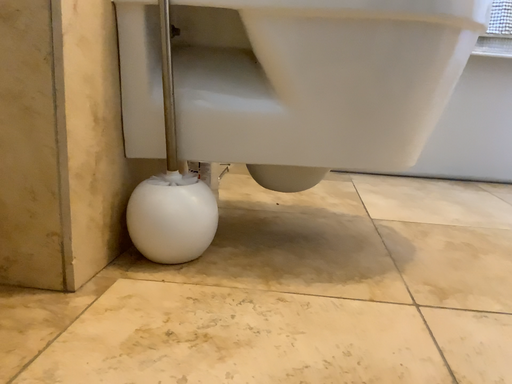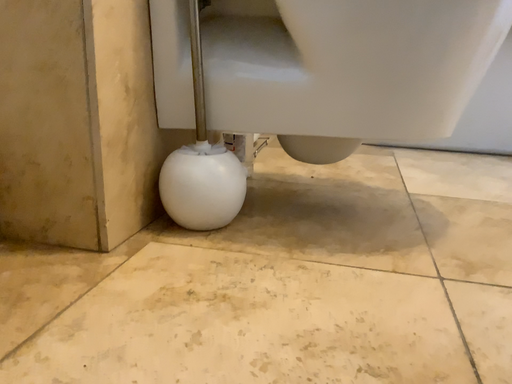
Question: Which way did the camera rotate in the video?

Choices:
 (A) rotated left
 (B) rotated right

Answer: (A)